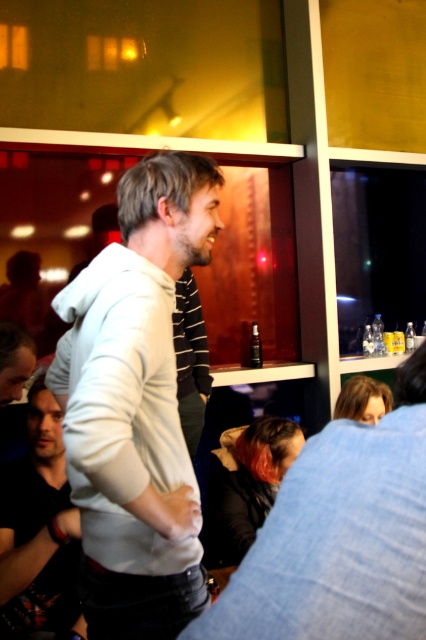
You are at a party and want to grab a drink. You see a white hoodie at center and a transparent plastic bottle at center. Which item is bigger?

The white hoodie at center is larger than the transparent plastic bottle at center.

You are at a bar and need to grab the transparent plastic bottle at center without touching the white hoodie at center. Is the bottle reachable from below?

The white hoodie at center is located above the transparent plastic bottle at center, so yes, the bottle is reachable from below without touching the hoodie.